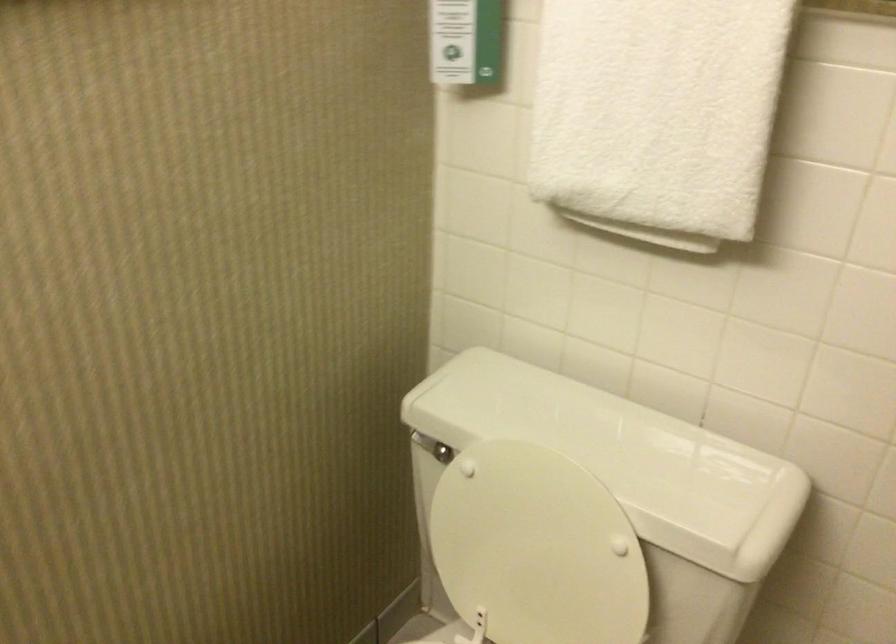
The location [657,114] corresponds to which object?

This point indicates the white towel.